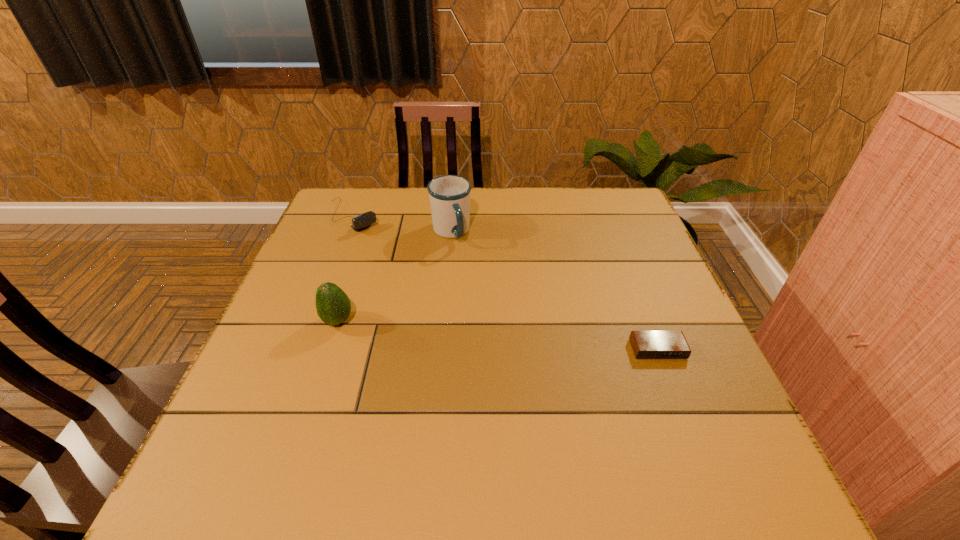
Where is `avocado`? Image resolution: width=960 pixels, height=540 pixels. avocado is located at coordinates (333, 306).

What are the coordinates of `the third farthest object` in the screenshot? It's located at (333, 306).

I want to click on the nearest object, so click(x=646, y=344).

At what (x,y) coordinates should I click in order to perform the action: click on the shortest object. Please return your answer as a coordinate pair (x, y). This screenshot has height=540, width=960. Looking at the image, I should click on (646, 344).

Locate an element on the screen. Image resolution: width=960 pixels, height=540 pixels. mug is located at coordinates (449, 195).

Where is `the tallest object`? the tallest object is located at coordinates (449, 195).

Find the location of `webcam`. webcam is located at coordinates (362, 221).

In order to click on vacant space located on the right of the third farthest object in this screenshot , I will do `click(449, 321)`.

This screenshot has height=540, width=960. I want to click on vacant space located 0.070m on the front face of the shortest object, so click(673, 387).

Where is `free spot located 0.150m on the handle side of the third object from left to right`? Image resolution: width=960 pixels, height=540 pixels. free spot located 0.150m on the handle side of the third object from left to right is located at coordinates (479, 281).